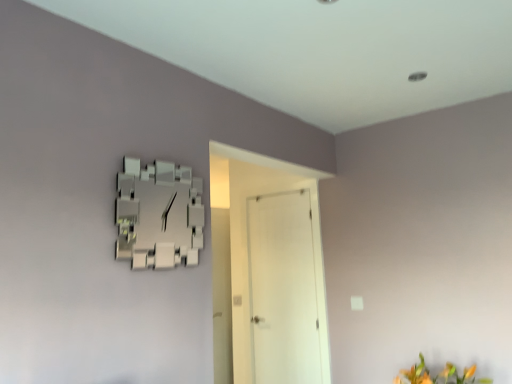
Question: Does white matte door at center have a smaller size compared to orange matte flower at lower right?

Choices:
 (A) yes
 (B) no

Answer: (B)

Question: Is white matte door at center next to orange matte flower at lower right?

Choices:
 (A) yes
 (B) no

Answer: (B)

Question: Considering the relative sizes of white matte door at center and orange matte flower at lower right in the image provided, is white matte door at center thinner than orange matte flower at lower right?

Choices:
 (A) no
 (B) yes

Answer: (B)

Question: Would you say white matte door at center is a long distance from orange matte flower at lower right?

Choices:
 (A) no
 (B) yes

Answer: (B)

Question: Can you confirm if white matte door at center is shorter than orange matte flower at lower right?

Choices:
 (A) no
 (B) yes

Answer: (A)

Question: From a real-world perspective, is white matte door at center on top of orange matte flower at lower right?

Choices:
 (A) no
 (B) yes

Answer: (B)

Question: Is orange matte flower at lower right turned away from white matte door at center?

Choices:
 (A) yes
 (B) no

Answer: (B)

Question: Considering the relative positions of orange matte flower at lower right and white matte door at center in the image provided, is orange matte flower at lower right to the left of white matte door at center from the viewer's perspective?

Choices:
 (A) yes
 (B) no

Answer: (B)

Question: Can you confirm if orange matte flower at lower right is thinner than white matte door at center?

Choices:
 (A) yes
 (B) no

Answer: (B)

Question: Is orange matte flower at lower right positioned in front of white matte door at center?

Choices:
 (A) yes
 (B) no

Answer: (A)

Question: Is orange matte flower at lower right outside of white matte door at center?

Choices:
 (A) no
 (B) yes

Answer: (B)

Question: Is orange matte flower at lower right smaller than white matte door at center?

Choices:
 (A) no
 (B) yes

Answer: (B)

Question: Visually, is white matte door at center positioned to the left or to the right of orange matte flower at lower right?

Choices:
 (A) left
 (B) right

Answer: (A)